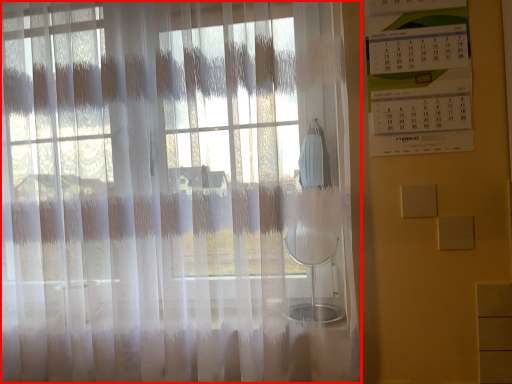
Question: From the image's perspective, what is the correct spatial relationship of curtain (annotated by the red box) in relation to bulletin board?

Choices:
 (A) above
 (B) below

Answer: (B)